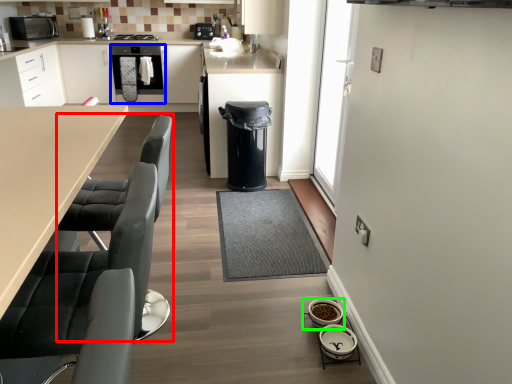
Question: Which object is the farthest from swivel chair (highlighted by a red box)? Choose among these: oven (highlighted by a blue box) or appliance (highlighted by a green box).

Choices:
 (A) oven
 (B) appliance

Answer: (A)